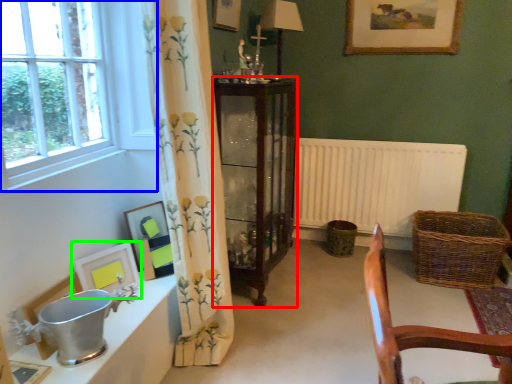
Question: Which is farther away from cabinetry (highlighted by a red box)? window (highlighted by a blue box) or picture frame (highlighted by a green box)?

Choices:
 (A) window
 (B) picture frame

Answer: (B)